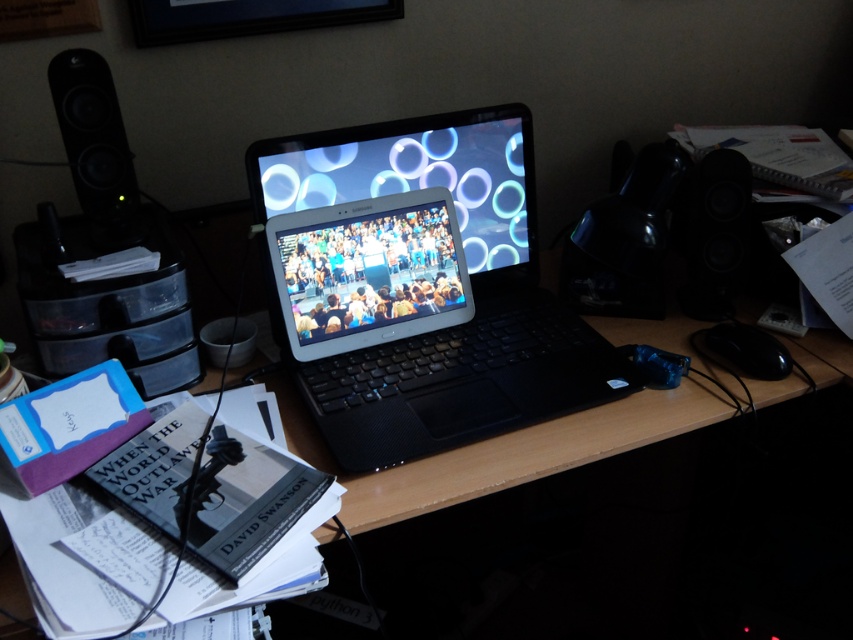
Question: Does satin black laptop at center appear on the left side of black matte speaker at right?

Choices:
 (A) no
 (B) yes

Answer: (B)

Question: Is black matte laptop at center positioned behind wooden desk at center?

Choices:
 (A) no
 (B) yes

Answer: (B)

Question: Which object is positioned farthest from the satin black laptop at center?

Choices:
 (A) wooden desk at center
 (B) black plastic mouse at right

Answer: (B)

Question: Which of the following is the closest to the observer?

Choices:
 (A) (77, 168)
 (B) (740, 179)

Answer: (A)

Question: Does wooden desk at center have a larger size compared to black plastic mouse at right?

Choices:
 (A) yes
 (B) no

Answer: (A)

Question: Which is nearer to the black plastic speaker at left?

Choices:
 (A) satin silver tablet at center
 (B) satin black laptop at center
 (C) black matte speaker at right
 (D) black plastic mouse at right

Answer: (A)